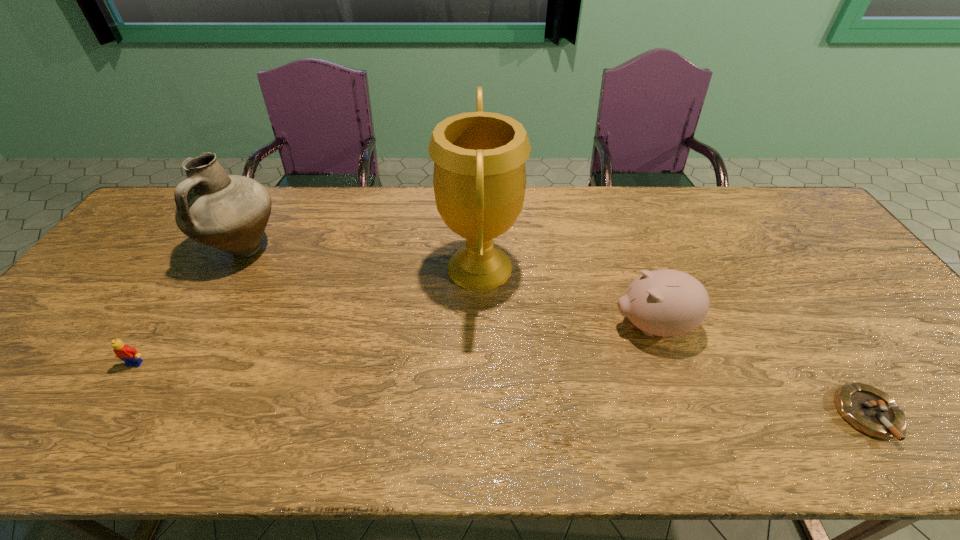
Find the location of a particular element. The height and width of the screenshot is (540, 960). vacant space located on the handle side of the pitcher is located at coordinates (166, 387).

The width and height of the screenshot is (960, 540). Find the location of `vacant region located at the snout of the third tallest object`. vacant region located at the snout of the third tallest object is located at coordinates (584, 326).

At what (x,y) coordinates should I click in order to perform the action: click on free space located at the snout of the third tallest object. Please return your answer as a coordinate pair (x, y). The height and width of the screenshot is (540, 960). Looking at the image, I should click on (521, 326).

The height and width of the screenshot is (540, 960). In order to click on vacant space situated at the snout of the third tallest object in this screenshot , I will do pos(544,326).

The image size is (960, 540). What are the coordinates of `vacant space situated on the face of the Lego` in the screenshot? It's located at (115, 394).

You are a GUI agent. You are given a task and a screenshot of the screen. Output one action in this format:
    pyautogui.click(x=<x>, y=<y>)
    Task: Click on the blank area located 0.190m on the back of the nearest object
    The width and height of the screenshot is (960, 540).
    Given the screenshot: What is the action you would take?
    pyautogui.click(x=805, y=321)

This screenshot has width=960, height=540. I want to click on trophy that is positioned at the far edge, so click(479, 179).

At what (x,y) coordinates should I click in order to perform the action: click on pitcher that is positioned at the far edge. Please return your answer as a coordinate pair (x, y). The image size is (960, 540). Looking at the image, I should click on (229, 212).

Locate an element on the screen. object that is at the near edge is located at coordinates (868, 409).

Where is `vacant space at the far edge of the desktop`? vacant space at the far edge of the desktop is located at coordinates (695, 222).